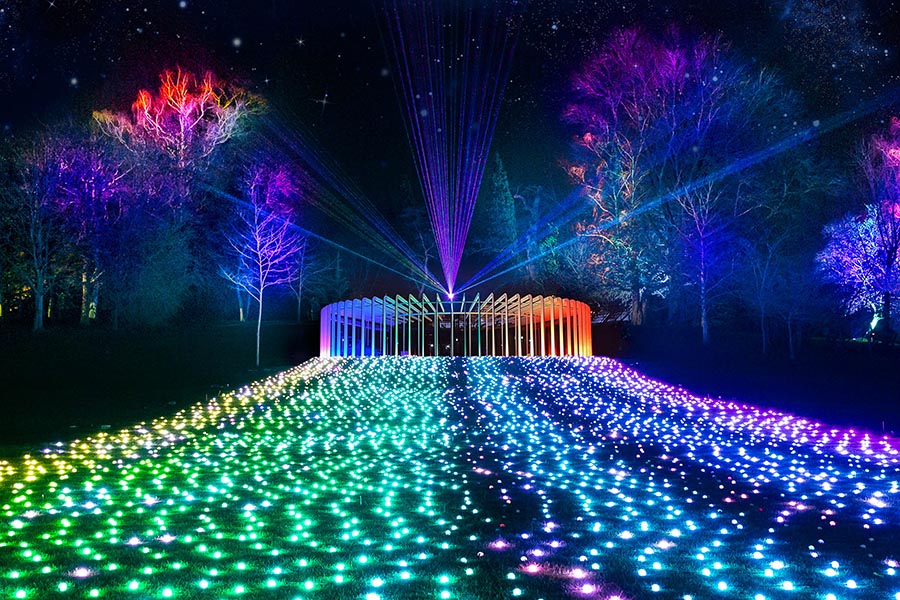
Where is `right section of lights`? right section of lights is located at coordinates (598, 497).